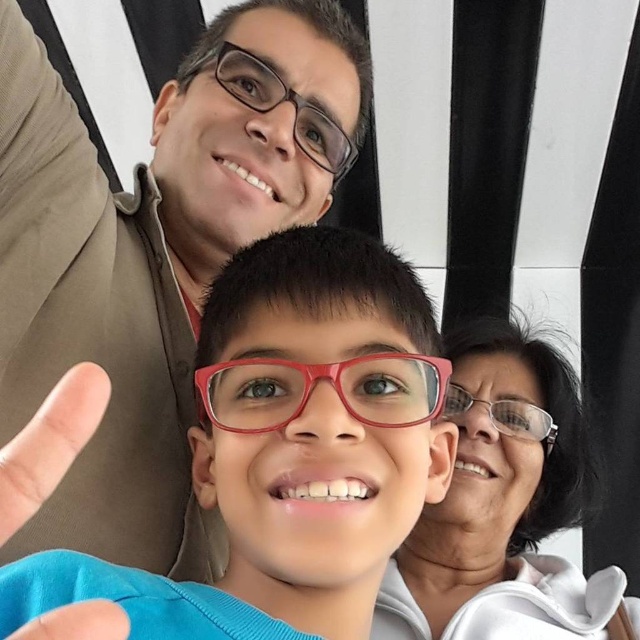
Question: Which point appears farthest from the camera in this image?

Choices:
 (A) (346, 371)
 (B) (547, 413)
 (C) (33, 435)
 (D) (333, 131)

Answer: (B)

Question: Which point appears farthest from the camera in this image?

Choices:
 (A) click(234, 218)
 (B) click(314, 525)
 (C) click(252, 86)
 (D) click(6, 484)

Answer: (C)

Question: Which point is farther to the camera?

Choices:
 (A) matte blue shirt at center
 (B) blue fabric hand at lower left
 (C) matte skin finger at lower left

Answer: (A)

Question: Does matte skin finger at lower left appear on the right side of blue fabric hand at lower left?

Choices:
 (A) no
 (B) yes

Answer: (A)

Question: Considering the relative positions of matte skin finger at lower left and blue fabric hand at lower left in the image provided, where is matte skin finger at lower left located with respect to blue fabric hand at lower left?

Choices:
 (A) left
 (B) right

Answer: (A)

Question: Where is matte skin finger at lower left located in relation to blue fabric hand at lower left in the image?

Choices:
 (A) above
 (B) below

Answer: (A)